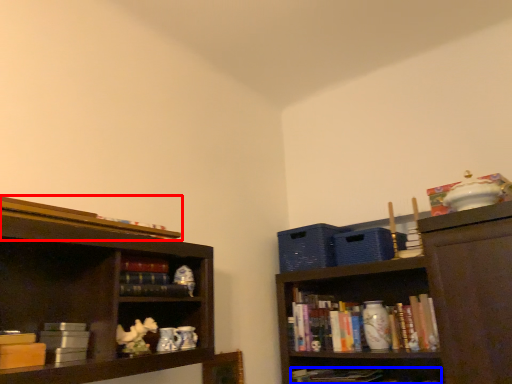
Question: Among these objects, which one is farthest to the camera, book (highlighted by a red box) or book (highlighted by a blue box)?

Choices:
 (A) book
 (B) book

Answer: (B)